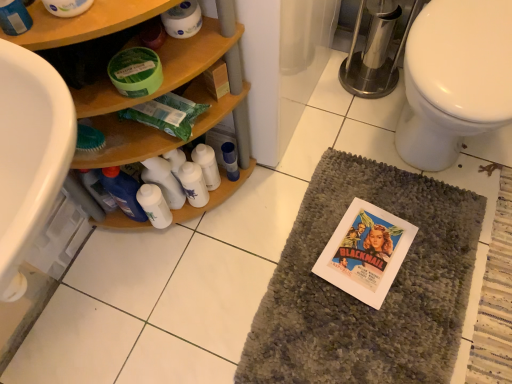
You are a GUI agent. You are given a task and a screenshot of the screen. Output one action in this format:
    pyautogui.click(x=<x>, y=<y>)
    Task: Click on the vacant area that lies between white glossy toilet at right and white glossy bottles at center, the second toiletry in the left-to-right sequence
    This screenshot has width=512, height=384.
    Given the screenshot: What is the action you would take?
    tap(333, 173)